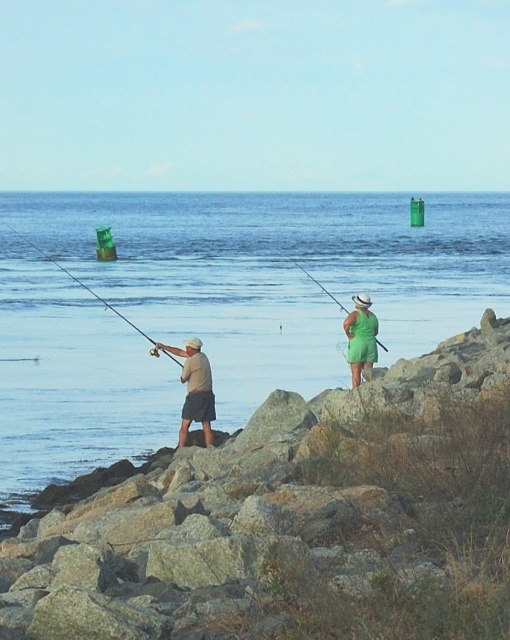
You are a photographer trying to capture both the matte black fishing pole at left and the green fabric fishing pole at center in a single shot. Which fishing pole should you focus on first to ensure both are in frame?

The matte black fishing pole at left is bigger than the green fabric fishing pole at center, so focusing on the larger one first will help ensure both fit within the camera frame.

You are standing on the rocky shoreline and want to cast your fishing line into the blue water at center. Which direction should you move relative to the matte black fishing pole at left?

The blue water at center is to the right of the matte black fishing pole at left, so you should move to the right of the matte black fishing pole at left to cast your line into the blue water at center.